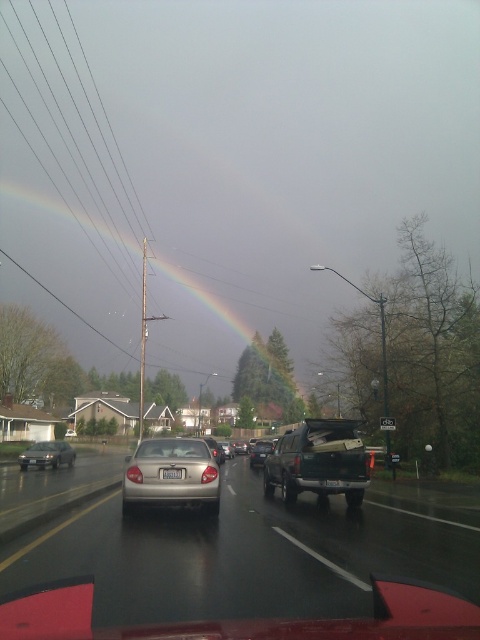
You are driving a car and notice a black plastic license plate at center and a shiny silver sedan at center on the road ahead. Which object is smaller in size?

The black plastic license plate at center is smaller than the shiny silver sedan at center.

In the scene shown: You are driving a car and see the black plastic license plate at center and the shiny silver sedan at center ahead. Which object is nearer to your car?

The black plastic license plate at center is closer to the viewer than the shiny silver sedan at center, so the license plate is nearer.

You are driving a car and looking at the road ahead. You see a gold matte sedan at center and a black plastic license plate at center. Which object is taller?

The gold matte sedan at center is taller than the black plastic license plate at center.